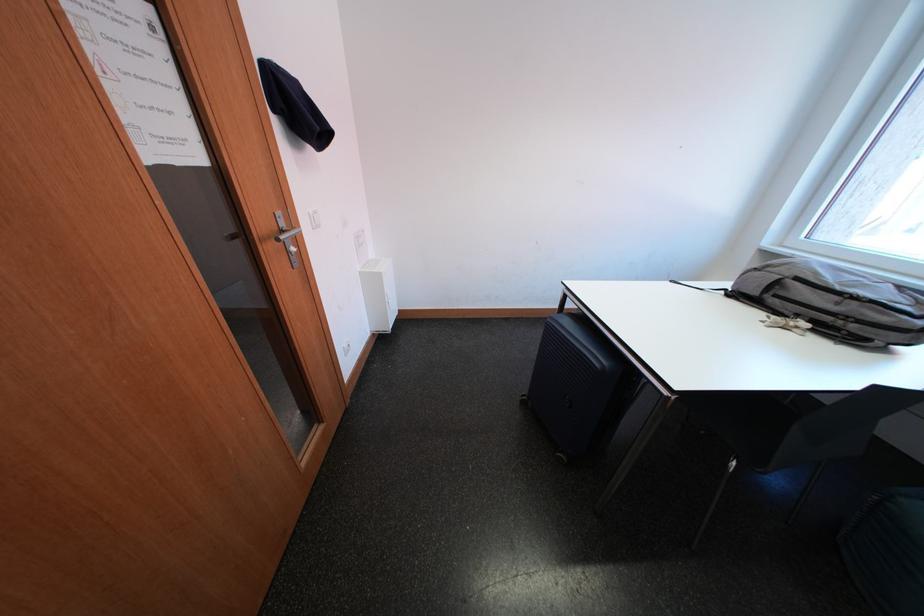
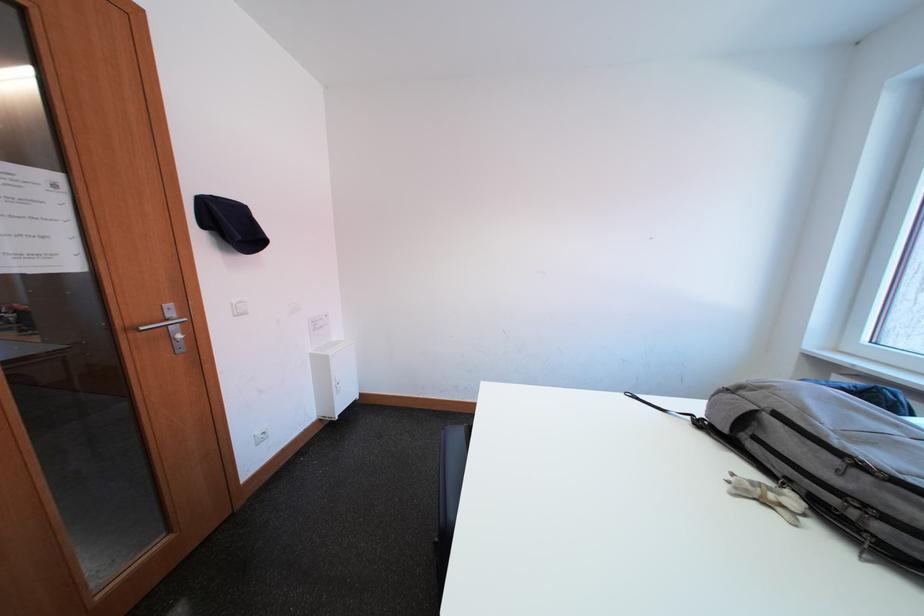
Locate, in the second image, the point that corresponds to (747,302) in the first image.

(719, 438)